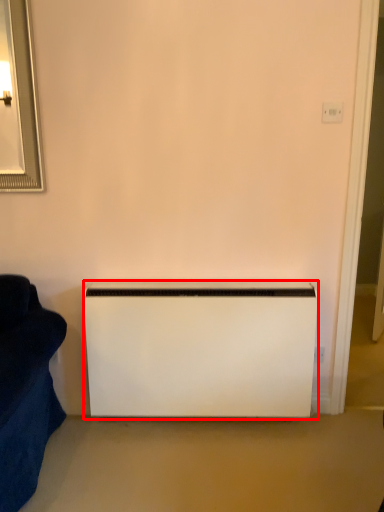
Question: From the image's perspective, where is appliance (annotated by the red box) located relative to electric outlet?

Choices:
 (A) below
 (B) above

Answer: (A)